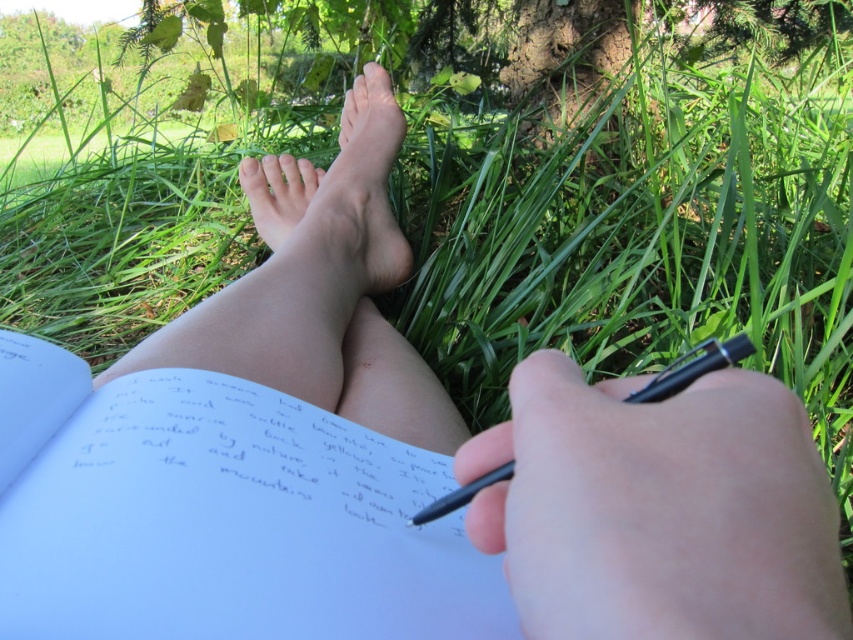
Question: Can you confirm if pale skin foot at center is positioned below black plastic pen at lower center?

Choices:
 (A) yes
 (B) no

Answer: (B)

Question: In this image, where is white paper journal at center located relative to black plastic pen at lower center?

Choices:
 (A) below
 (B) above

Answer: (A)

Question: Which point is farther to the camera?

Choices:
 (A) pale skin foot at center
 (B) white paper journal at center

Answer: (A)

Question: Which of these objects is positioned closest to the white paper journal at center?

Choices:
 (A) black plastic pen at lower center
 (B) pale skin foot at center

Answer: (A)

Question: Which object is positioned closest to the pale skin foot at center?

Choices:
 (A) white paper journal at center
 (B) black plastic pen at lower center

Answer: (A)

Question: Observing the image, what is the correct spatial positioning of white paper journal at center in reference to black plastic pen at lower center?

Choices:
 (A) above
 (B) below

Answer: (B)